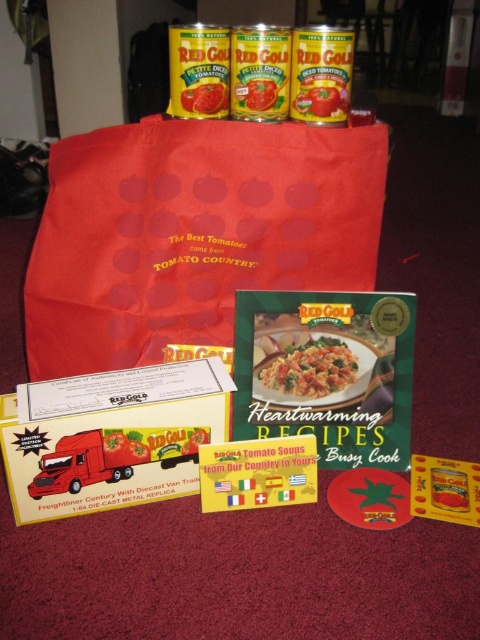
Can you confirm if red matte paper bag at upper center is positioned to the right of matte green book at center?

Incorrect, red matte paper bag at upper center is not on the right side of matte green book at center.

Is point (207, 300) in front of point (299, 342)?

That is False.

Locate an element on the screen. The width and height of the screenshot is (480, 640). red matte paper bag at upper center is located at coordinates (192, 234).

Consider the image. Does red matte paper bag at upper center appear over tomato paste can at upper center?

No, red matte paper bag at upper center is not above tomato paste can at upper center.

Is red matte paper bag at upper center below tomato paste can at upper center?

Yes, red matte paper bag at upper center is below tomato paste can at upper center.

Where is `red matte paper bag at upper center`? red matte paper bag at upper center is located at coordinates (192, 234).

Does point (300, 387) lie in front of point (214, 97)?

No, it is not.

This screenshot has width=480, height=640. Find the location of `matte green book at center`. matte green book at center is located at coordinates (308, 365).

You are a GUI agent. You are given a task and a screenshot of the screen. Output one action in this format:
    pyautogui.click(x=<x>, y=<y>)
    Task: Click on the matte green book at center
    
    Given the screenshot: What is the action you would take?
    (308, 365)